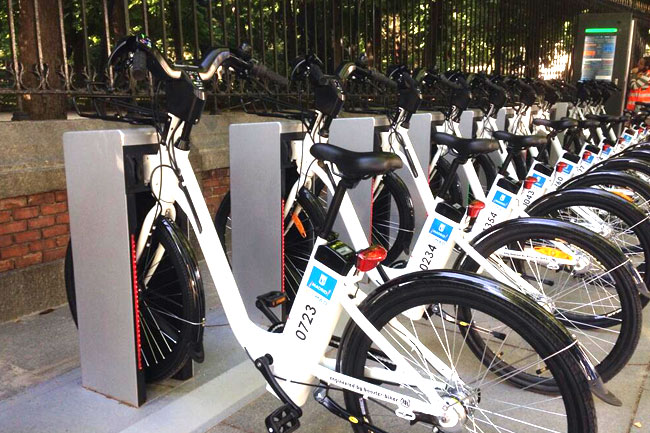
This screenshot has width=650, height=433. I want to click on right handle, so click(x=247, y=64), click(x=368, y=76), click(x=445, y=85), click(x=491, y=89), click(x=530, y=89), click(x=554, y=86), click(x=578, y=86).